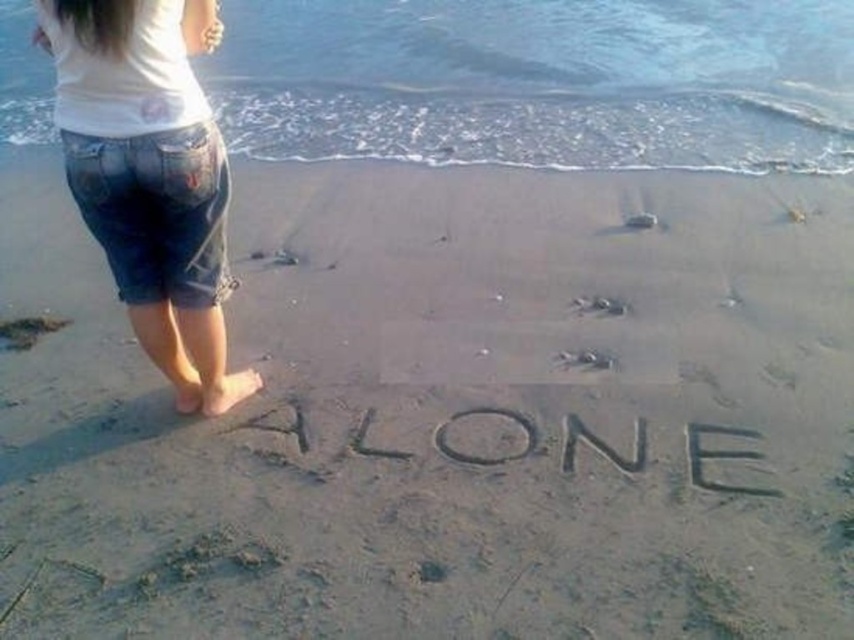
Can you confirm if denim shorts at left is wider than sand/textured sand at center?

No.

Is denim shorts at left positioned in front of sand/textured sand at center?

That is True.

Between point (145, 208) and point (706, 481), which one is positioned behind?

Positioned behind is point (706, 481).

The width and height of the screenshot is (854, 640). In order to click on denim shorts at left in this screenshot , I will do `click(151, 177)`.